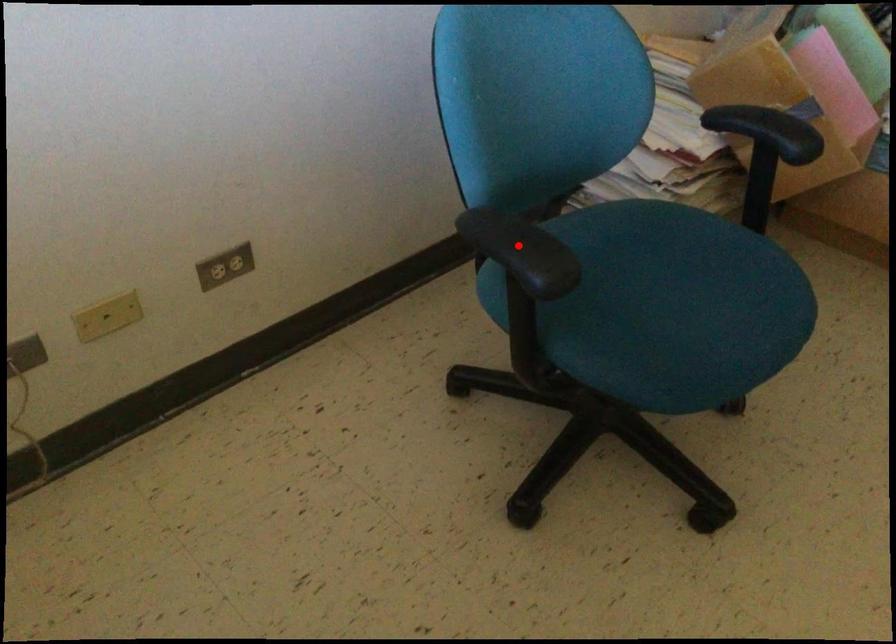
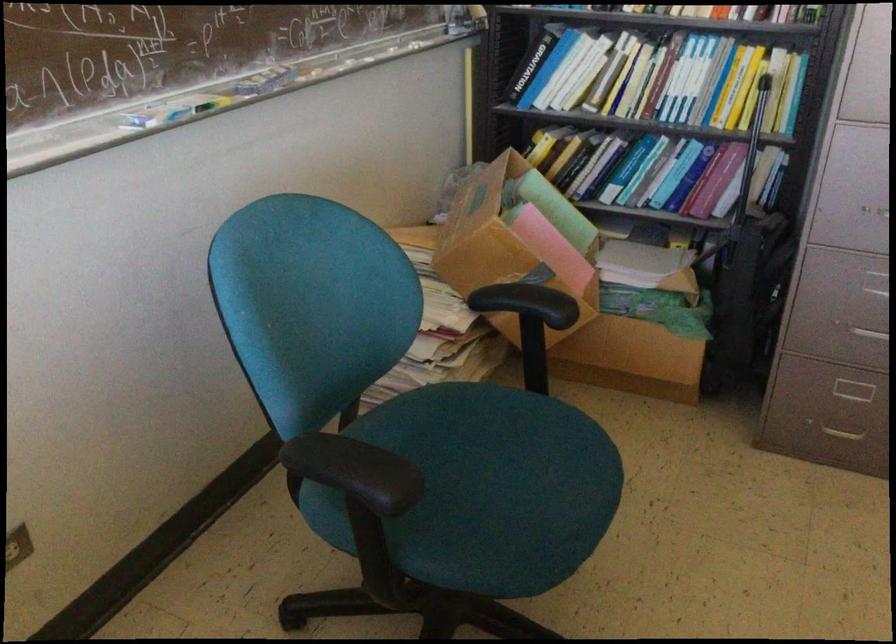
Find the pixel in the second image that matches the highlighted location in the first image.

(356, 471)